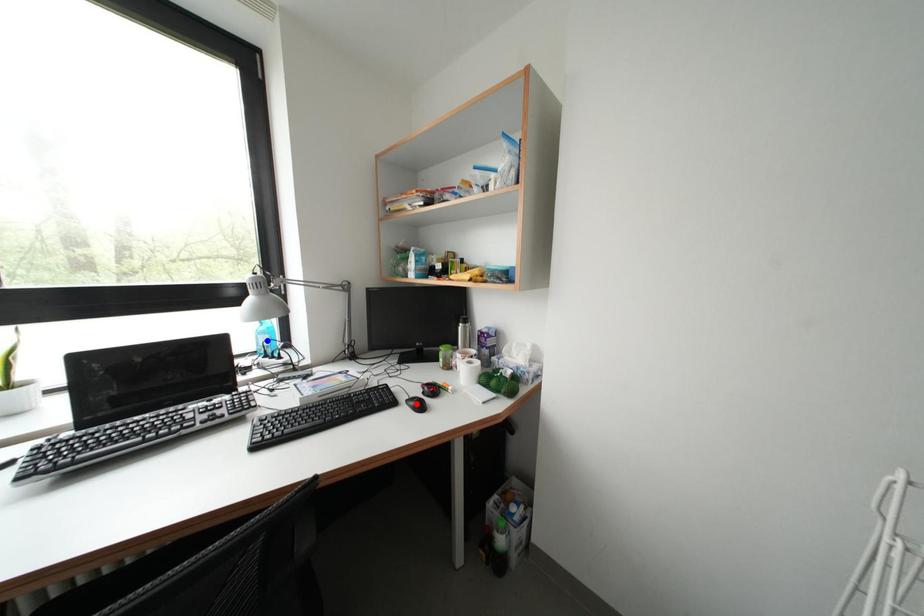
Question: In the image, two points are highlighted. Which point is nearer to the camera? Reply with the corresponding letter.

Choices:
 (A) blue point
 (B) red point

Answer: (B)